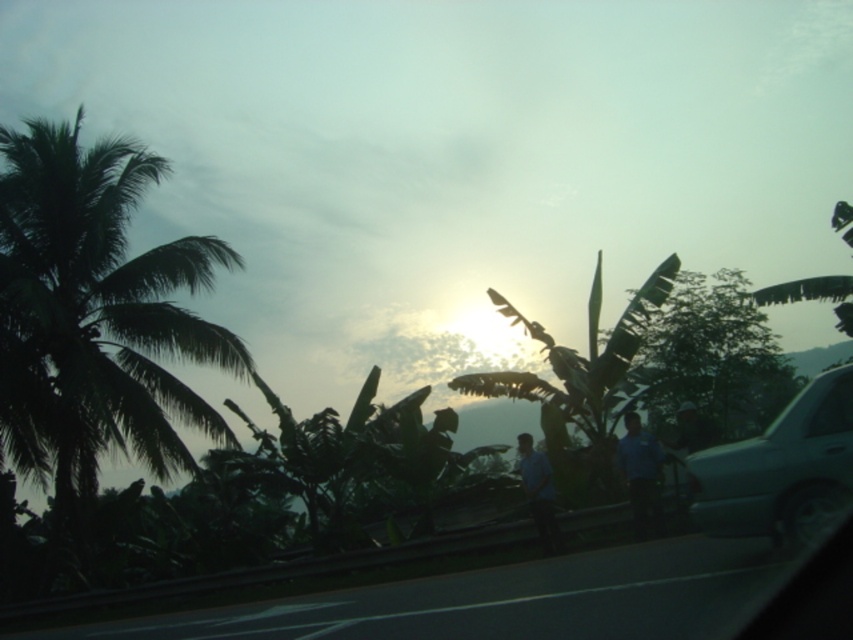
Question: Can you confirm if metallic blue car at right is positioned above transparent glass car window at right?

Choices:
 (A) no
 (B) yes

Answer: (A)

Question: Which point is farther to the camera?

Choices:
 (A) (663, 292)
 (B) (544, 515)

Answer: (A)

Question: Can you confirm if dark green leafy palm tree at left is bigger than green leafy coconut tree at center?

Choices:
 (A) no
 (B) yes

Answer: (B)

Question: Which object is the farthest from the blue uniform shirt at center?

Choices:
 (A) dark green leafy palm tree at left
 (B) blue fabric shirt at center

Answer: (A)

Question: Is blue cotton shirt at center below blue fabric shirt at center?

Choices:
 (A) yes
 (B) no

Answer: (A)

Question: Which object is positioned farthest from the blue uniform shirt at center?

Choices:
 (A) transparent glass car window at right
 (B) blue fabric shirt at center

Answer: (A)